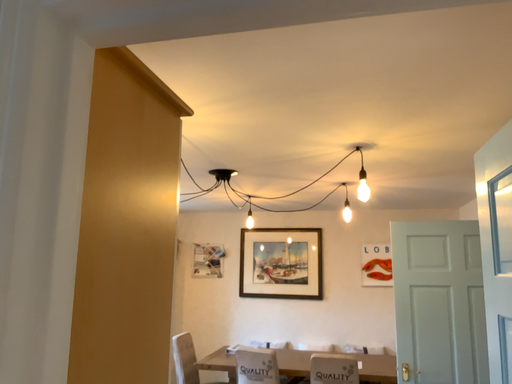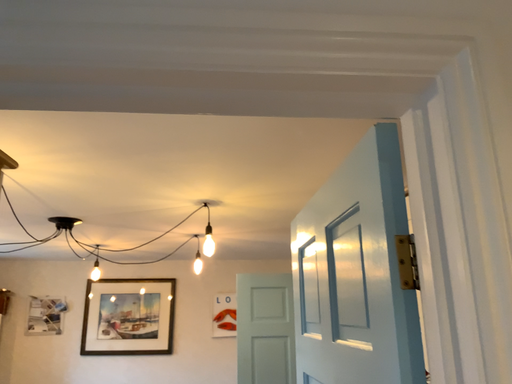
Question: How did the camera likely rotate when shooting the video?

Choices:
 (A) rotated left
 (B) rotated right

Answer: (B)